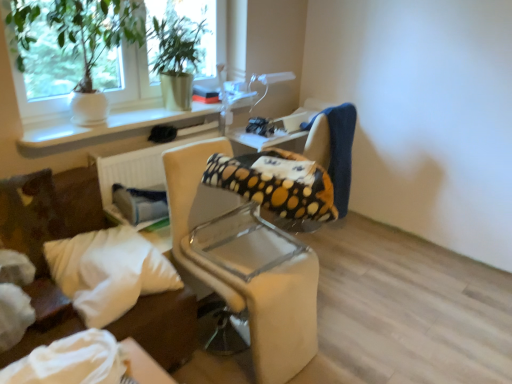
What is the approximate width of white ceramic vase at upper left?

white ceramic vase at upper left is 12.81 inches in width.

This screenshot has width=512, height=384. What do you see at coordinates (110, 125) in the screenshot?
I see `white ceramic vase at upper left` at bounding box center [110, 125].

Where is `green leafy plant in white pot at upper left, which is the second houseplant in right-to-left order`? The width and height of the screenshot is (512, 384). green leafy plant in white pot at upper left, which is the second houseplant in right-to-left order is located at coordinates (76, 30).

In order to face green matte plant at upper left, which ranks as the 1th houseplant in right-to-left order, should I rotate leftwards or rightwards?

Rotate your view left by about 9.546°.

The image size is (512, 384). Find the location of `green matte plant at upper left, which ranks as the 1th houseplant in right-to-left order`. green matte plant at upper left, which ranks as the 1th houseplant in right-to-left order is located at coordinates (x=176, y=53).

Describe the element at coordinates (136, 168) in the screenshot. I see `white plastic radiator at lower left` at that location.

This screenshot has width=512, height=384. What do you see at coordinates (108, 272) in the screenshot? I see `white soft pillow at lower left` at bounding box center [108, 272].

Locate an element on the screen. The width and height of the screenshot is (512, 384). white ceramic vase at upper left is located at coordinates (110, 125).

Is beige fabric chair at center, the 2th chair when ordered from back to front, positioned beyond the bounds of polka dot fabric chair at center, the 2th chair from the front?

That's correct, beige fabric chair at center, the 2th chair when ordered from back to front, is outside of polka dot fabric chair at center, the 2th chair from the front.

Which is more to the right, beige fabric chair at center, the 2th chair when ordered from back to front, or polka dot fabric chair at center, positioned as the 1th chair in back-to-front order?

From the viewer's perspective, polka dot fabric chair at center, positioned as the 1th chair in back-to-front order, appears more on the right side.

From a real-world perspective, is beige fabric chair at center, the 2th chair when ordered from back to front, located beneath polka dot fabric chair at center, positioned as the 1th chair in back-to-front order?

No, from a real-world perspective, beige fabric chair at center, the 2th chair when ordered from back to front, is not under polka dot fabric chair at center, positioned as the 1th chair in back-to-front order.

Does green matte plant at upper left, placed as the 2th houseplant when sorted from left to right, turn towards white soft pillow at lower left?

No, green matte plant at upper left, placed as the 2th houseplant when sorted from left to right, is not turned towards white soft pillow at lower left.

Does point (153, 63) come closer to viewer compared to point (153, 263)?

That is False.

Can you confirm if green matte plant at upper left, which ranks as the 1th houseplant in right-to-left order, is smaller than white soft pillow at lower left?

No.

Are green matte plant at upper left, which ranks as the 1th houseplant in right-to-left order, and white soft pillow at lower left beside each other?

No, green matte plant at upper left, which ranks as the 1th houseplant in right-to-left order, is not making contact with white soft pillow at lower left.

What's the angular difference between white soft pillow at lower left and beige fabric chair at center, which appears as the 1th chair when viewed from the front,'s facing directions?

0.342 degrees.

Which object is positioned more to the right, white soft pillow at lower left or beige fabric chair at center, the 2th chair when ordered from back to front?

Positioned to the right is beige fabric chair at center, the 2th chair when ordered from back to front.

Which of these two, white soft pillow at lower left or beige fabric chair at center, which appears as the 1th chair when viewed from the front, is bigger?

beige fabric chair at center, which appears as the 1th chair when viewed from the front.

From a real-world perspective, is white soft pillow at lower left on top of beige fabric chair at center, the 2th chair when ordered from back to front?

Correct, in the physical world, white soft pillow at lower left is higher than beige fabric chair at center, the 2th chair when ordered from back to front.

Could you tell me if green leafy plant in white pot at upper left, positioned as the 1th houseplant in left-to-right order, is facing polka dot fabric chair at center, positioned as the 1th chair in back-to-front order?

No, green leafy plant in white pot at upper left, positioned as the 1th houseplant in left-to-right order, is not oriented towards polka dot fabric chair at center, positioned as the 1th chair in back-to-front order.

Which of these two, green leafy plant in white pot at upper left, which is the second houseplant in right-to-left order, or polka dot fabric chair at center, positioned as the 1th chair in back-to-front order, stands taller?

polka dot fabric chair at center, positioned as the 1th chair in back-to-front order, is taller.

Measure the distance between green leafy plant in white pot at upper left, positioned as the 1th houseplant in left-to-right order, and polka dot fabric chair at center, the 2th chair from the front.

A distance of 3.54 feet exists between green leafy plant in white pot at upper left, positioned as the 1th houseplant in left-to-right order, and polka dot fabric chair at center, the 2th chair from the front.

At what (x,y) coordinates should I click in order to perform the action: click on the 1st chair below when counting from the green leafy plant in white pot at upper left, positioned as the 1th houseplant in left-to-right order (from the image's perspective). Please return your answer as a coordinate pair (x, y). The image size is (512, 384). Looking at the image, I should click on (298, 177).

Could green leafy plant in white pot at upper left, positioned as the 1th houseplant in left-to-right order, be considered to be inside green matte plant at upper left, which ranks as the 1th houseplant in right-to-left order?

No, green leafy plant in white pot at upper left, positioned as the 1th houseplant in left-to-right order, is not a part of green matte plant at upper left, which ranks as the 1th houseplant in right-to-left order.

Is green matte plant at upper left, placed as the 2th houseplant when sorted from left to right, facing towards green leafy plant in white pot at upper left, which is the second houseplant in right-to-left order?

No.

Is white soft pillow at lower left located within beige fabric chair at center, which appears as the 1th chair when viewed from the front?

No, white soft pillow at lower left is not surrounded by beige fabric chair at center, which appears as the 1th chair when viewed from the front.

Is beige fabric chair at center, the 2th chair when ordered from back to front, facing towards white soft pillow at lower left?

No, beige fabric chair at center, the 2th chair when ordered from back to front, is not oriented towards white soft pillow at lower left.

Can you tell me how much beige fabric chair at center, which appears as the 1th chair when viewed from the front, and white soft pillow at lower left differ in facing direction?

0.342 degrees.

Does beige fabric chair at center, which appears as the 1th chair when viewed from the front, have a larger size compared to white soft pillow at lower left?

Yes.

Between beige fabric chair at center, the 2th chair when ordered from back to front, and white ceramic vase at upper left, which one has larger width?

beige fabric chair at center, the 2th chair when ordered from back to front, is wider.

Between beige fabric chair at center, which appears as the 1th chair when viewed from the front, and white ceramic vase at upper left, which one appears on the right side from the viewer's perspective?

Positioned to the right is beige fabric chair at center, which appears as the 1th chair when viewed from the front.

Is point (213, 288) less distant than point (148, 111)?

Yes, point (213, 288) is in front of point (148, 111).

Identify the location of window sill located behind the beige fabric chair at center, the 2th chair when ordered from back to front. The height and width of the screenshot is (384, 512). (110, 125).

At what (x,y) coordinates should I click in order to perform the action: click on chair in front of the polka dot fabric chair at center, the 2th chair from the front. Please return your answer as a coordinate pair (x, y). Image resolution: width=512 pixels, height=384 pixels. Looking at the image, I should click on (244, 263).

The width and height of the screenshot is (512, 384). I want to click on pillow below the green matte plant at upper left, placed as the 2th houseplant when sorted from left to right (from the image's perspective), so click(x=108, y=272).

Looking at the image, which one is located closer to polka dot fabric chair at center, positioned as the 1th chair in back-to-front order, beige fabric chair at center, the 2th chair when ordered from back to front, or green matte plant at upper left, placed as the 2th houseplant when sorted from left to right?

beige fabric chair at center, the 2th chair when ordered from back to front.

Estimate the real-world distances between objects in this image. Which object is further from white ceramic vase at upper left, beige fabric chair at center, the 2th chair when ordered from back to front, or polka dot fabric chair at center, the 2th chair from the front?

beige fabric chair at center, the 2th chair when ordered from back to front.

From the image, which object appears to be nearer to white soft pillow at lower left, green matte plant at upper left, which ranks as the 1th houseplant in right-to-left order, or white plastic radiator at lower left?

Among the two, white plastic radiator at lower left is located nearer to white soft pillow at lower left.

Looking at the image, which one is located further to green matte plant at upper left, which ranks as the 1th houseplant in right-to-left order, polka dot fabric chair at center, the 2th chair from the front, or beige fabric chair at center, which appears as the 1th chair when viewed from the front?

beige fabric chair at center, which appears as the 1th chair when viewed from the front.

From the image, which object appears to be farther from white soft pillow at lower left, beige fabric chair at center, which appears as the 1th chair when viewed from the front, or green matte plant at upper left, placed as the 2th houseplant when sorted from left to right?

green matte plant at upper left, placed as the 2th houseplant when sorted from left to right, is further to white soft pillow at lower left.

From the image, which object appears to be nearer to white soft pillow at lower left, polka dot fabric chair at center, the 2th chair from the front, or green leafy plant in white pot at upper left, which is the second houseplant in right-to-left order?

green leafy plant in white pot at upper left, which is the second houseplant in right-to-left order.

Looking at the image, which one is located further to white soft pillow at lower left, white ceramic vase at upper left or polka dot fabric chair at center, the 2th chair from the front?

polka dot fabric chair at center, the 2th chair from the front, is positioned further to the anchor white soft pillow at lower left.

In the scene shown: Estimate the real-world distances between objects in this image. Which object is further from green matte plant at upper left, placed as the 2th houseplant when sorted from left to right, white plastic radiator at lower left or white soft pillow at lower left?

The object further to green matte plant at upper left, placed as the 2th houseplant when sorted from left to right, is white soft pillow at lower left.

What are the coordinates of `houseplant between green leafy plant in white pot at upper left, which is the second houseplant in right-to-left order, and white plastic radiator at lower left, along the z-axis` in the screenshot? It's located at (176, 53).

Image resolution: width=512 pixels, height=384 pixels. In order to click on radiator between white soft pillow at lower left and polka dot fabric chair at center, the 2th chair from the front, in the front-back direction in this screenshot , I will do `click(136, 168)`.

Where is `window sill between green matte plant at upper left, which ranks as the 1th houseplant in right-to-left order, and white plastic radiator at lower left from top to bottom`? The width and height of the screenshot is (512, 384). window sill between green matte plant at upper left, which ranks as the 1th houseplant in right-to-left order, and white plastic radiator at lower left from top to bottom is located at coordinates (110, 125).

Locate an element on the screen. This screenshot has height=384, width=512. radiator that lies between green matte plant at upper left, placed as the 2th houseplant when sorted from left to right, and beige fabric chair at center, the 2th chair when ordered from back to front, from top to bottom is located at coordinates (136, 168).